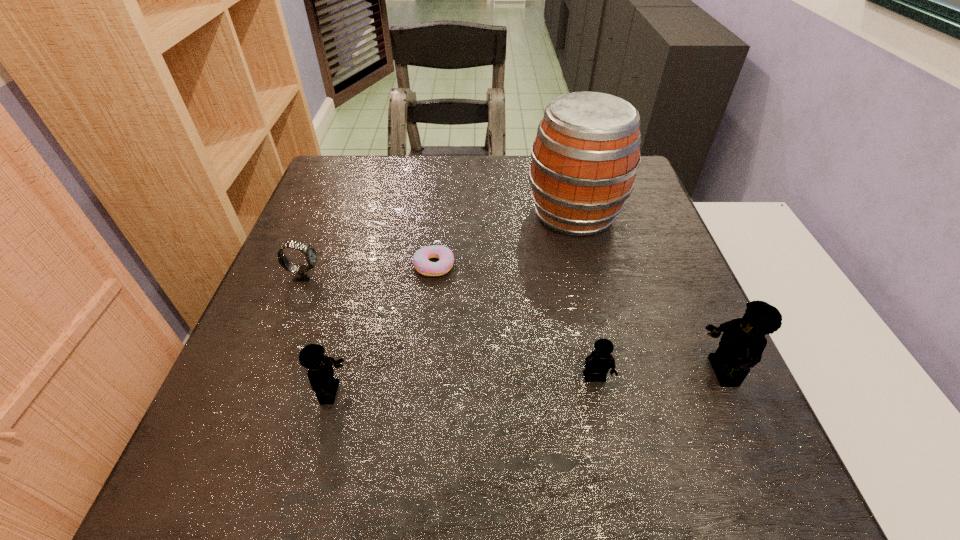
At what (x,y) coordinates should I click in order to perform the action: click on the second shortest Lego. Please return your answer as a coordinate pair (x, y). Looking at the image, I should click on [320, 372].

What are the coordinates of `the third tallest object` in the screenshot? It's located at (320, 372).

Locate an element on the screen. The width and height of the screenshot is (960, 540). the shortest Lego is located at coordinates (x=598, y=363).

The image size is (960, 540). I want to click on the rightmost Lego, so click(743, 341).

Identify the location of the fifth shortest object. The height and width of the screenshot is (540, 960). (743, 341).

At what (x,y) coordinates should I click in order to perform the action: click on the third object from left to right. Please return your answer as a coordinate pair (x, y). This screenshot has height=540, width=960. Looking at the image, I should click on (420, 260).

Where is `doughnut`? doughnut is located at coordinates (420, 260).

The image size is (960, 540). Identify the location of cider. (584, 160).

The image size is (960, 540). In order to click on the farthest object in this screenshot , I will do `click(584, 160)`.

Where is `watch`? This screenshot has height=540, width=960. watch is located at coordinates (304, 273).